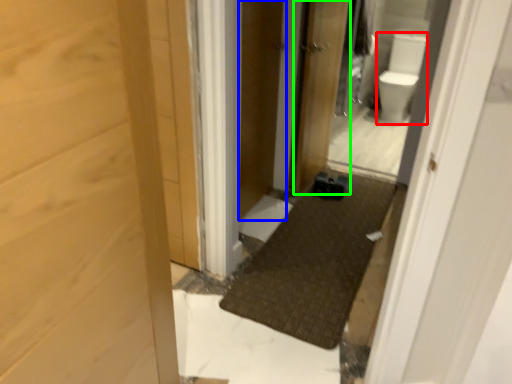
Question: Which object is the closest to the toilet bowl (highlighted by a red box)? Choose among these: screen door (highlighted by a blue box) or door (highlighted by a green box).

Choices:
 (A) screen door
 (B) door

Answer: (B)